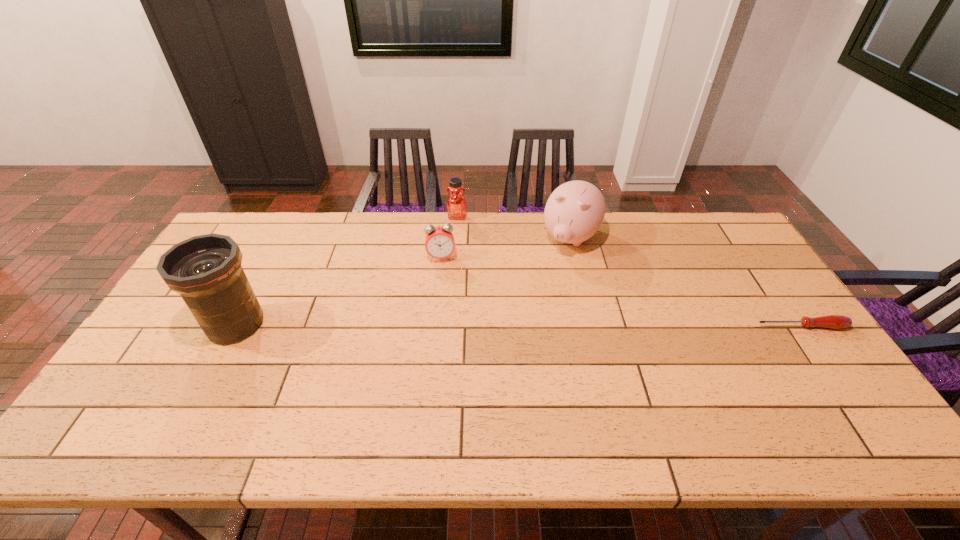
Locate an element on the screen. This screenshot has height=540, width=960. the tallest object is located at coordinates (206, 271).

At what (x,y) coordinates should I click in order to perform the action: click on the leftmost object. Please return your answer as a coordinate pair (x, y). Looking at the image, I should click on (206, 271).

The width and height of the screenshot is (960, 540). Find the location of `the shortest object`. the shortest object is located at coordinates (831, 321).

The width and height of the screenshot is (960, 540). In order to click on the rightmost object in this screenshot , I will do `click(831, 321)`.

Identify the location of the second object from right to left. (575, 210).

This screenshot has height=540, width=960. Identify the location of piggy bank. (575, 210).

The height and width of the screenshot is (540, 960). Identify the location of the third tallest object. (456, 205).

The image size is (960, 540). I want to click on alarm clock, so click(x=439, y=241).

Locate an element on the screen. The image size is (960, 540). free location located 0.130m on the front of the tallest object is located at coordinates (200, 393).

Image resolution: width=960 pixels, height=540 pixels. Identify the location of vacant region located at the tip of the screwdriver. (852, 399).